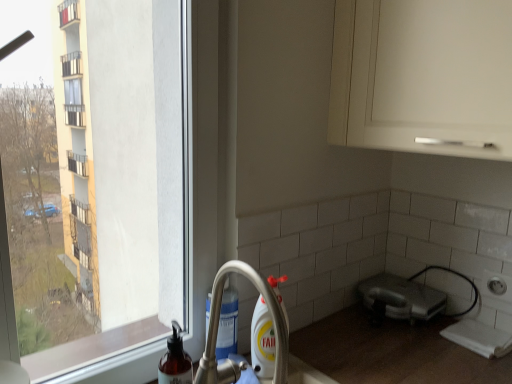
Question: From their relative heights in the image, would you say translucent plastic soap dispenser at lower left is taller or shorter than satin silver toaster at lower right?

Choices:
 (A) tall
 (B) short

Answer: (A)

Question: Relative to satin silver toaster at lower right, is translucent plastic soap dispenser at lower left in front or behind?

Choices:
 (A) behind
 (B) front

Answer: (B)

Question: Which object is the closest to the satin silver toaster at lower right?

Choices:
 (A) translucent plastic soap dispenser at lower left
 (B) silver metallic faucet at lower center

Answer: (B)

Question: Based on their relative distances, which object is nearer to the translucent plastic soap dispenser at lower left?

Choices:
 (A) satin silver toaster at lower right
 (B) silver metallic faucet at lower center

Answer: (B)